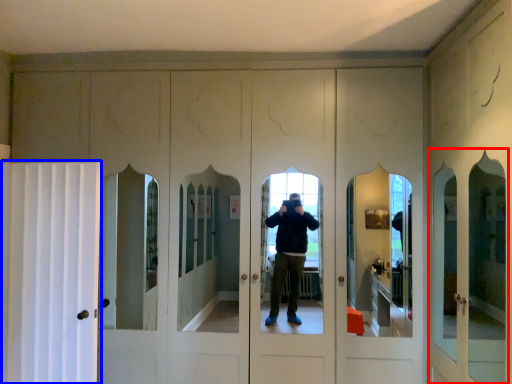
Question: Which object is further to the camera taking this photo, screen door (highlighted by a red box) or curtain (highlighted by a blue box)?

Choices:
 (A) screen door
 (B) curtain

Answer: (B)